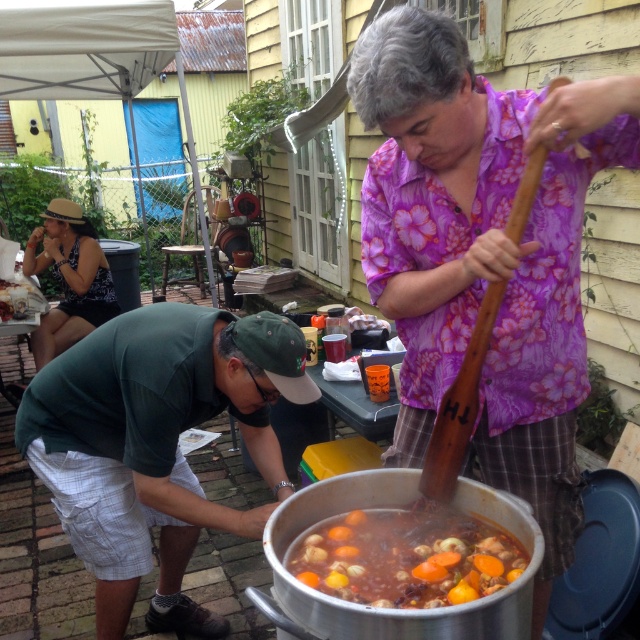
You are a photographer trying to capture a clear shot of the green fabric cap at center and the green fabric shirt at lower left. Which object should you focus on first to ensure both are in the frame?

The green fabric cap at center is in front of the green fabric shirt at lower left, so you should focus on the green fabric shirt at lower left first to ensure both are in the frame.

You are a photographer trying to capture a candid shot of both the green fabric cap at center and the matte black tank top at left. Since you want to ensure both are clearly visible, which clothing item should you focus on first to avoid blurring due to their size difference?

The green fabric cap at center occupies less space than the matte black tank top at left, so you should focus on the green fabric cap at center first to ensure its smaller details are sharp before capturing the larger matte black tank top at left.